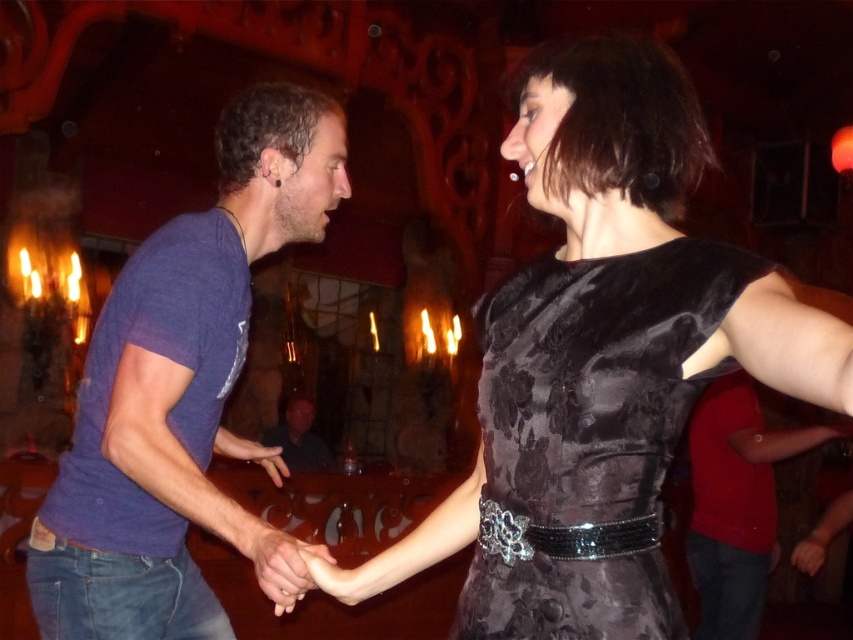
You are a photographer positioned in the room and want to capture a photo of both the matte blue shirt at left and the smooth skin hand at center. Which object should you focus on first to ensure it appears sharp in the photo?

The matte blue shirt at left is further to the viewer than the smooth skin hand at center, so you should focus on the matte blue shirt at left first to ensure it appears sharp in the photo.